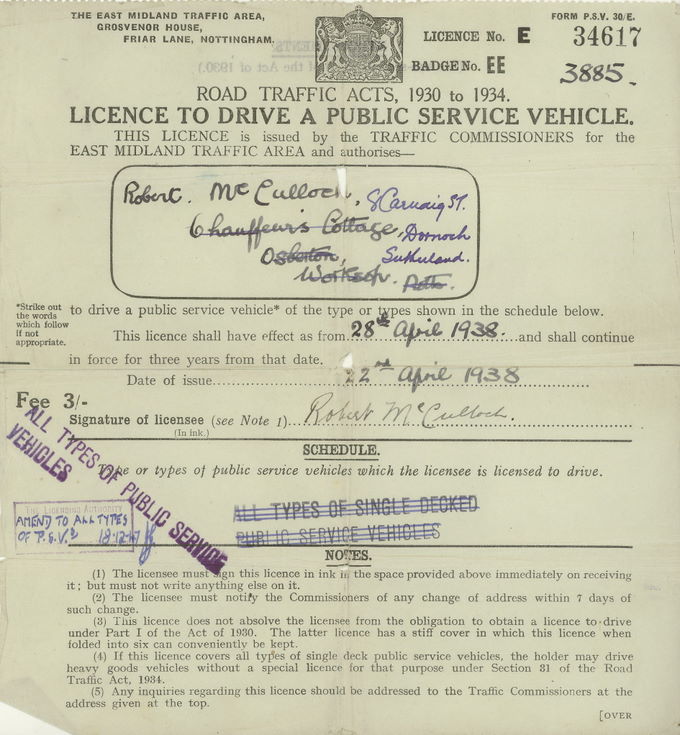
At what (x,y) coordinates should I click in order to perform the action: click on notes. Please return your answer as a coordinate pair (x, y). This screenshot has height=735, width=680. Looking at the image, I should click on [x=345, y=553].